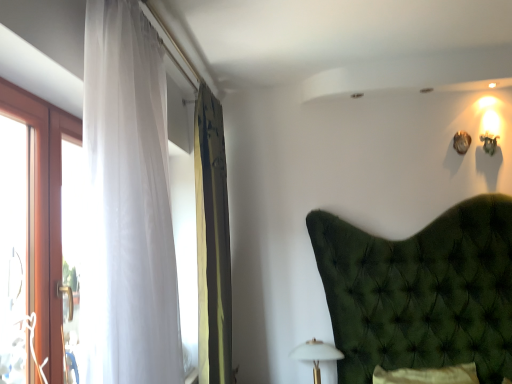
Question: From a real-world perspective, is white matte table lamp at lower center under translucent white curtain at left, the 2th curtain from the back?

Choices:
 (A) no
 (B) yes

Answer: (B)

Question: Is white matte table lamp at lower center with translucent white curtain at left, the first curtain when ordered from front to back?

Choices:
 (A) no
 (B) yes

Answer: (A)

Question: Is white matte table lamp at lower center further to the viewer compared to translucent white curtain at left, the first curtain when ordered from front to back?

Choices:
 (A) no
 (B) yes

Answer: (B)

Question: Is white matte table lamp at lower center at the left side of translucent white curtain at left, the 2th curtain from the back?

Choices:
 (A) no
 (B) yes

Answer: (A)

Question: Does white matte table lamp at lower center lie in front of translucent white curtain at left, the first curtain when ordered from front to back?

Choices:
 (A) no
 (B) yes

Answer: (A)

Question: Does white matte table lamp at lower center have a lesser height compared to translucent white curtain at left, the 2th curtain from the back?

Choices:
 (A) no
 (B) yes

Answer: (B)

Question: Is translucent white curtain at left, the first curtain when ordered from front to back, turned away from white matte table lamp at lower center?

Choices:
 (A) no
 (B) yes

Answer: (A)

Question: Could white matte table lamp at lower center be considered to be inside translucent white curtain at left, the 2th curtain from the back?

Choices:
 (A) yes
 (B) no

Answer: (B)

Question: Is translucent white curtain at left, the 2th curtain from the back, smaller than white matte table lamp at lower center?

Choices:
 (A) no
 (B) yes

Answer: (A)

Question: Can you confirm if translucent white curtain at left, the 2th curtain from the back, is positioned to the left of white matte table lamp at lower center?

Choices:
 (A) yes
 (B) no

Answer: (A)

Question: Can you confirm if translucent white curtain at left, the first curtain when ordered from front to back, is wider than white matte table lamp at lower center?

Choices:
 (A) no
 (B) yes

Answer: (B)

Question: Is translucent white curtain at left, the 2th curtain from the back, not within white matte table lamp at lower center?

Choices:
 (A) yes
 (B) no

Answer: (A)

Question: Is white matte table lamp at lower center facing towards green textured curtain at left, the second curtain positioned from the front?

Choices:
 (A) yes
 (B) no

Answer: (B)